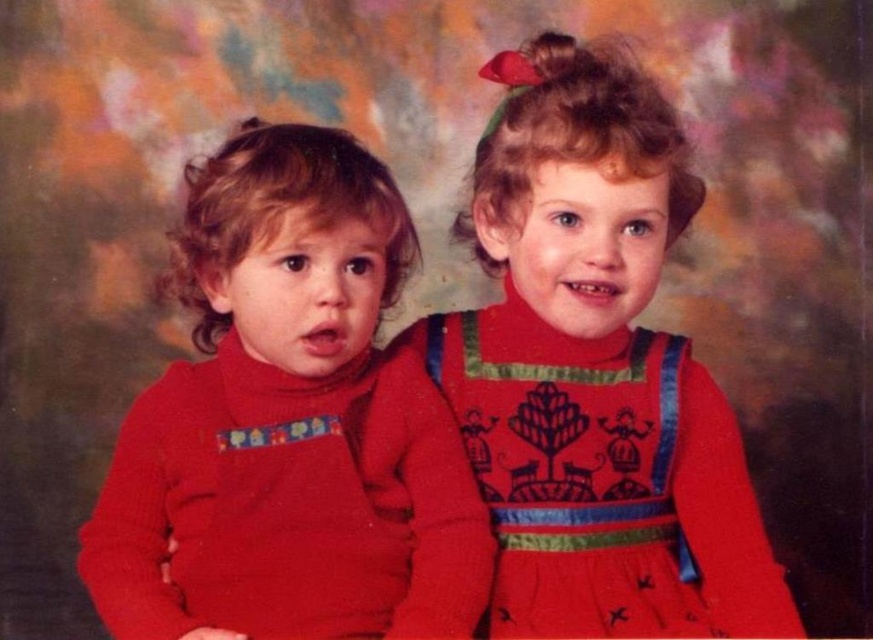
You are an artist looking at the image and want to draw the matte red sweater at left. Where should you place it on your canvas if the canvas coordinates are the same as the image coordinates?

You should place the matte red sweater at left at the coordinates point (289, 422) on your canvas since that is its 2D location in the image.

You are a photographer setting up a shoot. You need to place a small prop exactly at the point marked as point [289,422]. What object is located at that point?

The point [289,422] is occupied by the matte red sweater at left.